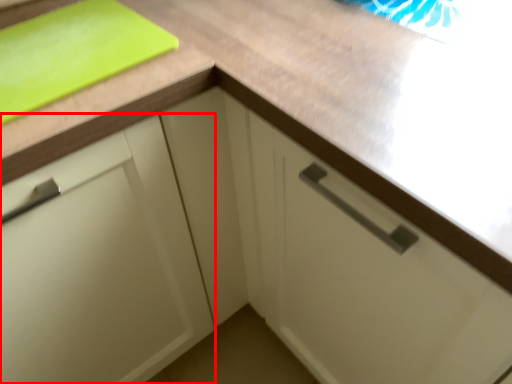
Question: Where is cabinetry (annotated by the red box) located in relation to cutting board in the image?

Choices:
 (A) right
 (B) left

Answer: (B)